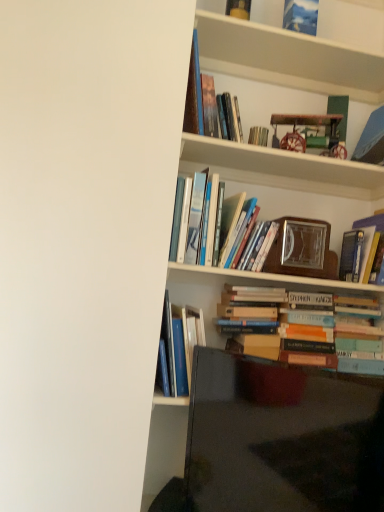
The width and height of the screenshot is (384, 512). Describe the element at coordinates (239, 234) in the screenshot. I see `hardcover books at center, positioned as the fourth book in bottom-to-top order` at that location.

How much space does hardcover books at center, which is counted as the fourth book, starting from the top, occupy vertically?

It is 32.70 centimeters.

The width and height of the screenshot is (384, 512). What are the coordinates of `hardcover books at center, which is counted as the fourth book, starting from the top` in the screenshot? It's located at (228, 226).

Where is `wooden picture frame at center-right`? The height and width of the screenshot is (512, 384). wooden picture frame at center-right is located at coordinates (302, 249).

This screenshot has width=384, height=512. What do you see at coordinates (301, 16) in the screenshot?
I see `metallic silver picture frame at upper center, which is the 2th book in top-to-bottom order` at bounding box center [301, 16].

This screenshot has height=512, width=384. I want to click on blue hardcover book at lower left, the 1th book in the bottom-to-top sequence, so click(x=178, y=348).

Consider the image. Are hardcover book at upper right, which appears as the sixth book when viewed from the top, and matte black tv at lower right located far from each other?

No, hardcover book at upper right, which appears as the sixth book when viewed from the top, is not far away from matte black tv at lower right.

The height and width of the screenshot is (512, 384). Identify the location of table located underneath the hardcover book at upper right, which appears as the sixth book when viewed from the top (from a real-world perspective). (270, 437).

Which object is further away from the camera taking this photo, hardcover book at upper right, which appears as the sixth book when viewed from the top, or matte black tv at lower right?

hardcover book at upper right, which appears as the sixth book when viewed from the top, is further from the camera.

Is blue hardcover book at lower left, the 1th book in the bottom-to-top sequence, smaller than wooden clock at upper center?

No, blue hardcover book at lower left, the 1th book in the bottom-to-top sequence, is not smaller than wooden clock at upper center.

Is blue hardcover book at lower left, the 8th book from the top, beside wooden clock at upper center?

They are not placed beside each other.

What's the angular difference between blue hardcover book at lower left, the 8th book from the top, and wooden clock at upper center's facing directions?

0.000384 degrees separate the facing orientations of blue hardcover book at lower left, the 8th book from the top, and wooden clock at upper center.

Is blue hardcover book at lower left, the 1th book in the bottom-to-top sequence, not within wooden clock at upper center?

Yes, blue hardcover book at lower left, the 1th book in the bottom-to-top sequence, is located beyond the bounds of wooden clock at upper center.

Which object is closer to the camera, hardcover books at center, which is the second book in bottom-to-top order, or hardcover books at center, positioned as the fourth book in bottom-to-top order?

hardcover books at center, which is the second book in bottom-to-top order, is more forward.

Which object is positioned more to the left, hardcover books at center, the 7th book when ordered from top to bottom, or hardcover books at center, the 5th book from the top?

Positioned to the left is hardcover books at center, the 5th book from the top.

Is hardcover books at center, which is the second book in bottom-to-top order, touching hardcover books at center, the 5th book from the top?

No, hardcover books at center, which is the second book in bottom-to-top order, is not touching hardcover books at center, the 5th book from the top.

Based on the photo, is hardcover books at center, the 7th book when ordered from top to bottom, looking in the opposite direction of hardcover books at center, positioned as the fourth book in bottom-to-top order?

No, hardcover books at center, positioned as the fourth book in bottom-to-top order, is not at the back of hardcover books at center, the 7th book when ordered from top to bottom.

Between point (253, 138) and point (190, 320), which one is positioned in front?

Point (190, 320)

Looking at this image, is metallic silver book at upper center, the sixth book in the bottom-to-top sequence, not inside blue hardcover book at lower left, the 8th book from the top?

Yes, metallic silver book at upper center, the sixth book in the bottom-to-top sequence, is located beyond the bounds of blue hardcover book at lower left, the 8th book from the top.

Who is more distant, metallic silver book at upper center, the sixth book in the bottom-to-top sequence, or blue hardcover book at lower left, the 1th book in the bottom-to-top sequence?

metallic silver book at upper center, the sixth book in the bottom-to-top sequence, is more distant.

I want to click on book that is the 1st object located below the metallic silver picture frame at upper center, which is the 2th book in top-to-bottom order (from the image's perspective), so click(258, 136).

Does metallic silver book at upper center, the sixth book in the bottom-to-top sequence, have a smaller size compared to metallic silver picture frame at upper center, which is the 2th book in top-to-bottom order?

Correct, metallic silver book at upper center, the sixth book in the bottom-to-top sequence, occupies less space than metallic silver picture frame at upper center, which is the 2th book in top-to-bottom order.

Is metallic silver book at upper center, marked as the 3th book in a top-to-bottom arrangement, not inside metallic silver picture frame at upper center, positioned as the seventh book in bottom-to-top order?

That's correct, metallic silver book at upper center, marked as the 3th book in a top-to-bottom arrangement, is outside of metallic silver picture frame at upper center, positioned as the seventh book in bottom-to-top order.

From a real-world perspective, which is physically below, metallic silver book at upper center, the sixth book in the bottom-to-top sequence, or metallic silver picture frame at upper center, positioned as the seventh book in bottom-to-top order?

metallic silver book at upper center, the sixth book in the bottom-to-top sequence, is physically lower.

Between point (237, 10) and point (293, 18), which one is positioned behind?

Point (293, 18)

Locate an element on the screen. book located above the metallic silver picture frame at upper center, which is the 2th book in top-to-bottom order (from the image's perspective) is located at coordinates (238, 9).

Who is more distant, matte yellow book at upper center, marked as the eighth book in a bottom-to-top arrangement, or metallic silver picture frame at upper center, which is the 2th book in top-to-bottom order?

metallic silver picture frame at upper center, which is the 2th book in top-to-bottom order.

Find the location of a particular element. The width and height of the screenshot is (384, 512). the 1st book behind when counting from the hardcover books at center, which is the fifth book from bottom to top is located at coordinates (298, 330).

Does hardcover books at center, which is counted as the fourth book, starting from the top, turn towards hardcover books at center, the 7th book when ordered from top to bottom?

No.

Is hardcover books at center, which is the fifth book from bottom to top, inside the boundaries of hardcover books at center, which is the second book in bottom-to-top order, or outside?

hardcover books at center, which is the fifth book from bottom to top, is located beyond the bounds of hardcover books at center, which is the second book in bottom-to-top order.

From the image's perspective, who appears lower, hardcover books at center, which is the fifth book from bottom to top, or hardcover books at center, which is the second book in bottom-to-top order?

hardcover books at center, which is the second book in bottom-to-top order, appears lower in the image.

Where is `table located underneath the hardcover book at upper right, which appears as the sixth book when viewed from the top (from a real-world perspective)`? table located underneath the hardcover book at upper right, which appears as the sixth book when viewed from the top (from a real-world perspective) is located at coordinates (270, 437).

At what (x,y) coordinates should I click in order to perform the action: click on cabinet behind the blue hardcover book at lower left, the 1th book in the bottom-to-top sequence. Please return your answer as a coordinate pair (x, y). The height and width of the screenshot is (512, 384). Looking at the image, I should click on (281, 168).

Looking at the image, which one is located further to metallic silver book at upper center, the sixth book in the bottom-to-top sequence, wooden bookshelf at upper center or matte yellow book at upper center, marked as the eighth book in a bottom-to-top arrangement?

matte yellow book at upper center, marked as the eighth book in a bottom-to-top arrangement, lies further to metallic silver book at upper center, the sixth book in the bottom-to-top sequence, than the other object.

Based on their spatial positions, is wooden picture frame at center-right or blue hardcover book at lower left, the 1th book in the bottom-to-top sequence, closer to metallic silver book at upper center, the sixth book in the bottom-to-top sequence?

Based on the image, wooden picture frame at center-right appears to be nearer to metallic silver book at upper center, the sixth book in the bottom-to-top sequence.

Which object lies further to the anchor point wooden bookshelf at upper center, hardcover books at center, which is counted as the fourth book, starting from the top, or matte yellow book at upper center, arranged as the first book when viewed from the top?

hardcover books at center, which is counted as the fourth book, starting from the top.

Based on their spatial positions, is matte yellow book at upper center, marked as the eighth book in a bottom-to-top arrangement, or matte black tv at lower right closer to wooden picture frame at center-right?

matte black tv at lower right is closer to wooden picture frame at center-right.

When comparing their distances from wooden clock at upper center, does hardcover books at center, the 7th book when ordered from top to bottom, or hardcover books at center, which is the fifth book from bottom to top, seem closer?

Based on the image, hardcover books at center, which is the fifth book from bottom to top, appears to be nearer to wooden clock at upper center.

When comparing their distances from hardcover books at center, which is the fifth book from bottom to top, does metallic silver book at upper center, the sixth book in the bottom-to-top sequence, or hardcover book at upper right, which appears as the sixth book when viewed from the top, seem further?

hardcover book at upper right, which appears as the sixth book when viewed from the top.

When comparing their distances from hardcover books at center, which is the second book in bottom-to-top order, does matte yellow book at upper center, arranged as the first book when viewed from the top, or wooden clock at upper center seem closer?

wooden clock at upper center.

When comparing their distances from hardcover books at center, which is the fifth book from bottom to top, does blue hardcover book at lower left, the 1th book in the bottom-to-top sequence, or matte yellow book at upper center, marked as the eighth book in a bottom-to-top arrangement, seem further?

matte yellow book at upper center, marked as the eighth book in a bottom-to-top arrangement, is positioned further to the anchor hardcover books at center, which is the fifth book from bottom to top.

At what (x,y) coordinates should I click in order to perform the action: click on cabinet that lies between metallic silver picture frame at upper center, positioned as the seventh book in bottom-to-top order, and hardcover books at center, which is the fifth book from bottom to top, from top to bottom. Please return your answer as a coordinate pair (x, y). The width and height of the screenshot is (384, 512). Looking at the image, I should click on (281, 168).

At what (x,y) coordinates should I click in order to perform the action: click on picture frame that lies between matte yellow book at upper center, marked as the eighth book in a bottom-to-top arrangement, and hardcover books at center, the 7th book when ordered from top to bottom, from top to bottom. Please return your answer as a coordinate pair (x, y). Image resolution: width=384 pixels, height=512 pixels. Looking at the image, I should click on (302, 249).

At what (x,y) coordinates should I click in order to perform the action: click on picture frame between matte yellow book at upper center, arranged as the first book when viewed from the top, and blue hardcover book at lower left, the 1th book in the bottom-to-top sequence, in the up-down direction. Please return your answer as a coordinate pair (x, y). The image size is (384, 512). Looking at the image, I should click on (302, 249).

I want to click on table between blue hardcover book at lower left, the 1th book in the bottom-to-top sequence, and hardcover book at upper right, the 3th book in the bottom-to-top sequence, from left to right, so click(x=270, y=437).